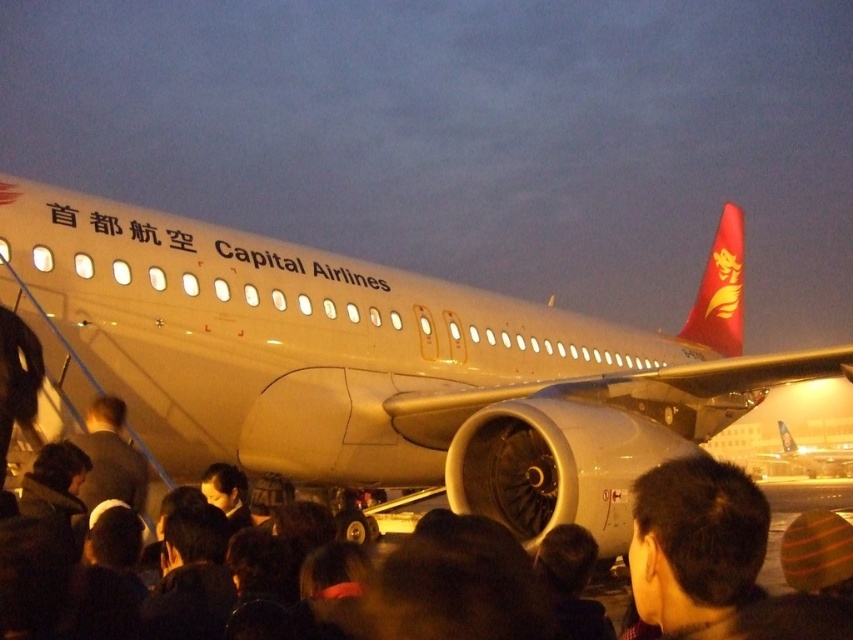
You are a baggage cart operator at the airport. You need to move a cart that is 2 meters wide through the path between the black matte crowd at lower center and the matte white airplane at center. Can you safely navigate the cart through this path without hitting either?

The distance between the black matte crowd at lower center and the matte white airplane at center is 2.20 meters. Since the cart is 2 meters wide, there is enough space to navigate safely as the path is wider than the cart.

You are standing at the point labeled as point [793,516] in the image. What do you see directly in front of you?

You see the black matte crowd at lower center directly in front of you at point [793,516].